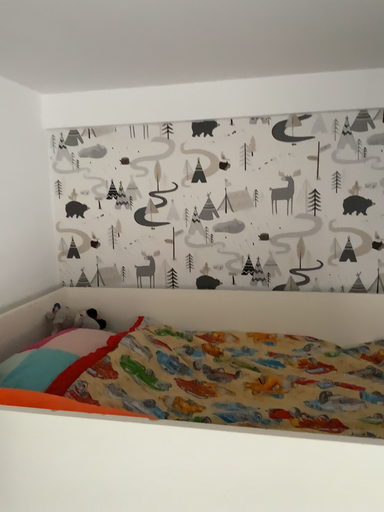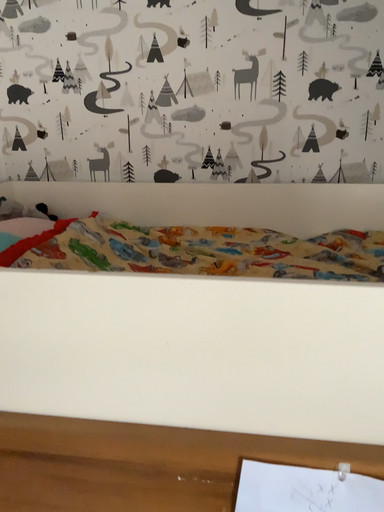
Question: How did the camera likely rotate when shooting the video?

Choices:
 (A) rotated downward
 (B) rotated upward

Answer: (A)